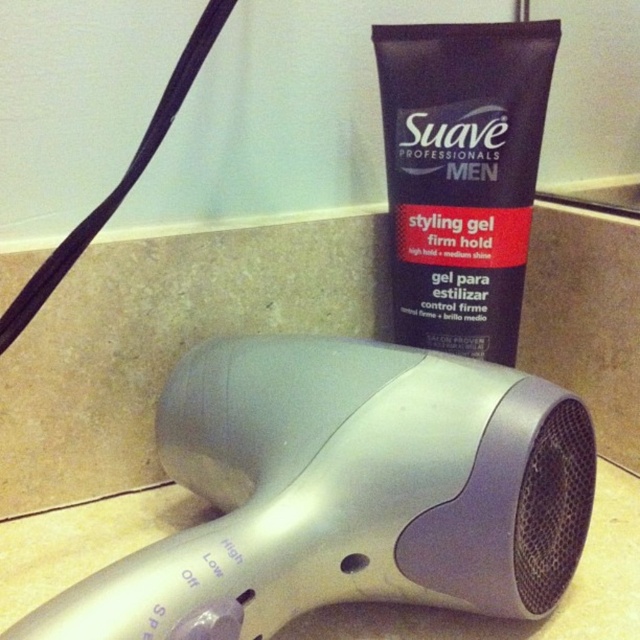
Question: Among these points, which one is farthest from the camera?

Choices:
 (A) (486, 472)
 (B) (484, 77)

Answer: (B)

Question: Is silver plastic hair dryer at lower center further to camera compared to dark blue matte tube at upper center?

Choices:
 (A) yes
 (B) no

Answer: (B)

Question: Can you confirm if silver plastic hair dryer at lower center is smaller than dark blue matte tube at upper center?

Choices:
 (A) no
 (B) yes

Answer: (A)

Question: Among these objects, which one is nearest to the camera?

Choices:
 (A) dark blue matte tube at upper center
 (B) silver plastic hair dryer at lower center

Answer: (B)

Question: Which of the following is the farthest from the observer?

Choices:
 (A) silver plastic hair dryer at lower center
 (B) dark blue matte tube at upper center

Answer: (B)

Question: Does silver plastic hair dryer at lower center have a larger size compared to dark blue matte tube at upper center?

Choices:
 (A) yes
 (B) no

Answer: (A)